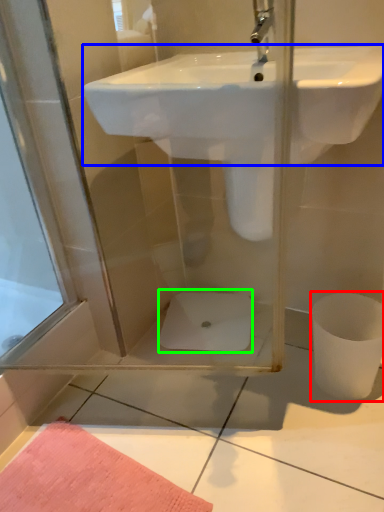
Question: Which object is positioned closest to toilet bowl (highlighted by a red box)? Select from sink (highlighted by a blue box) and toilet bowl (highlighted by a green box).

Choices:
 (A) sink
 (B) toilet bowl

Answer: (B)